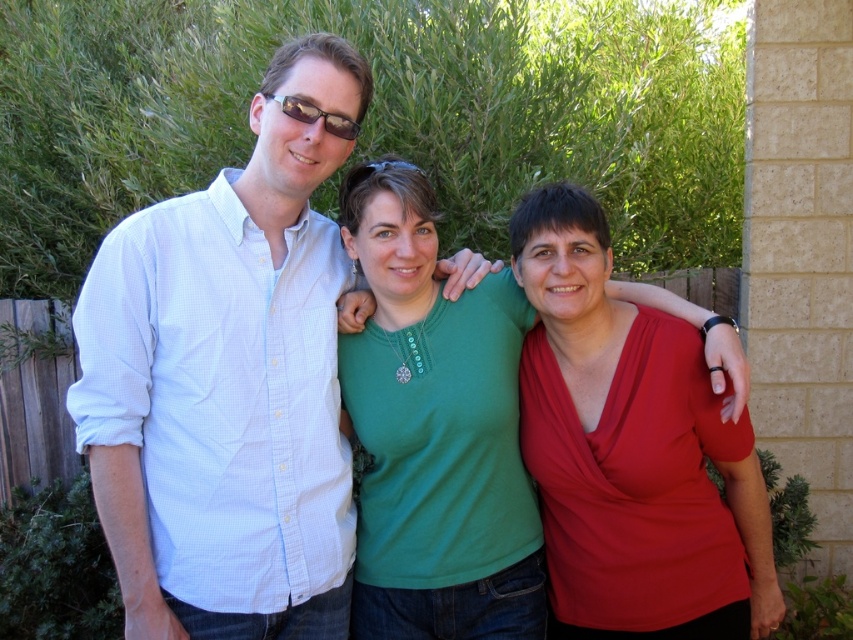
Question: Among these objects, which one is nearest to the camera?

Choices:
 (A) green matte shirt at center
 (B) white checkered shirt at left

Answer: (B)

Question: Which point is closer to the camera taking this photo?

Choices:
 (A) (136, 620)
 (B) (427, 317)

Answer: (A)

Question: Does white checkered shirt at left appear over green matte shirt at center?

Choices:
 (A) no
 (B) yes

Answer: (B)

Question: Does white checkered shirt at left have a larger size compared to green matte shirt at center?

Choices:
 (A) yes
 (B) no

Answer: (A)

Question: In this image, where is white checkered shirt at left located relative to green matte shirt at center?

Choices:
 (A) above
 (B) below

Answer: (A)